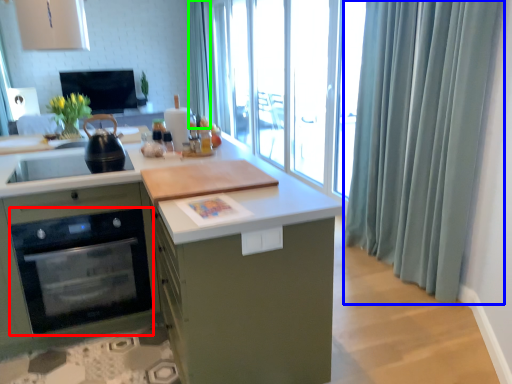
Question: Estimate the real-world distances between objects in this image. Which object is closer to home appliance (highlighted by a red box), shower curtain (highlighted by a blue box) or shower curtain (highlighted by a green box)?

Choices:
 (A) shower curtain
 (B) shower curtain

Answer: (A)